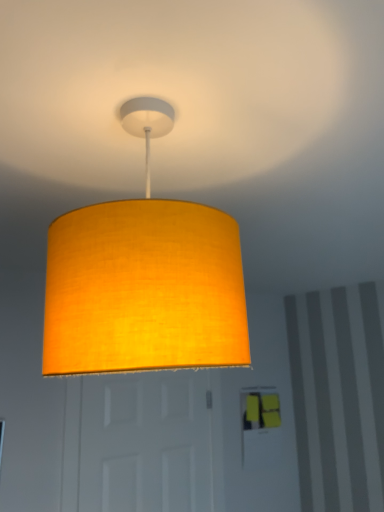
The image size is (384, 512). In order to click on matte yellow fabric lampshade at upper center in this screenshot , I will do `click(144, 279)`.

What do you see at coordinates (144, 279) in the screenshot? I see `matte yellow fabric lampshade at upper center` at bounding box center [144, 279].

This screenshot has height=512, width=384. Find the location of `white matte door at center`. white matte door at center is located at coordinates (146, 443).

What is the approximate height of white matte door at center?

white matte door at center is 70.88 centimeters in height.

Measure the distance between white matte door at center and camera.

white matte door at center and camera are 1.71 meters apart from each other.

From the picture: What is the approximate width of white matte door at center?

white matte door at center is 5.30 inches wide.

This screenshot has height=512, width=384. What do you see at coordinates (146, 443) in the screenshot?
I see `white matte door at center` at bounding box center [146, 443].

Locate an element on the screen. Image resolution: width=384 pixels, height=512 pixels. matte yellow fabric lampshade at upper center is located at coordinates (144, 279).

Between white matte door at center and matte yellow fabric lampshade at upper center, which one appears on the left side from the viewer's perspective?

white matte door at center is more to the left.

Which object is closer to the camera taking this photo, white matte door at center or matte yellow fabric lampshade at upper center?

matte yellow fabric lampshade at upper center is closer to the camera.

Is point (204, 373) positioned in front of point (51, 306)?

No, it is not.

From the image's perspective, relative to matte yellow fabric lampshade at upper center, is white matte door at center above or below?

From the image's perspective, white matte door at center appears below matte yellow fabric lampshade at upper center.

From a real-world perspective, which is physically above, white matte door at center or matte yellow fabric lampshade at upper center?

In real-world perspective, matte yellow fabric lampshade at upper center is above.

Which object is wider, white matte door at center or matte yellow fabric lampshade at upper center?

matte yellow fabric lampshade at upper center is wider.

Can you confirm if white matte door at center is shorter than matte yellow fabric lampshade at upper center?

No, white matte door at center is not shorter than matte yellow fabric lampshade at upper center.

Based on their sizes in the image, would you say white matte door at center is bigger or smaller than matte yellow fabric lampshade at upper center?

white matte door at center is bigger than matte yellow fabric lampshade at upper center.

Is matte yellow fabric lampshade at upper center inside white matte door at center?

That's incorrect, matte yellow fabric lampshade at upper center is not inside white matte door at center.

Is white matte door at center positioned far away from matte yellow fabric lampshade at upper center?

white matte door at center is far away from matte yellow fabric lampshade at upper center.

Is white matte door at center aimed at matte yellow fabric lampshade at upper center?

Yes, white matte door at center is aimed at matte yellow fabric lampshade at upper center.

Identify the location of lamp above the white matte door at center (from the image's perspective). (144, 279).

Considering the relative positions of matte yellow fabric lampshade at upper center and white matte door at center in the image provided, is matte yellow fabric lampshade at upper center to the left of white matte door at center from the viewer's perspective?

No.

Which is in front, matte yellow fabric lampshade at upper center or white matte door at center?

Positioned in front is matte yellow fabric lampshade at upper center.

Which is farther from the camera, (90, 352) or (175, 437)?

The point (175, 437) is more distant.

From the image's perspective, is matte yellow fabric lampshade at upper center over white matte door at center?

Yes.

From a real-world perspective, who is located lower, matte yellow fabric lampshade at upper center or white matte door at center?

white matte door at center.

In terms of width, does matte yellow fabric lampshade at upper center look wider or thinner when compared to white matte door at center?

Considering their sizes, matte yellow fabric lampshade at upper center looks broader than white matte door at center.

Does matte yellow fabric lampshade at upper center have a greater height compared to white matte door at center?

In fact, matte yellow fabric lampshade at upper center may be shorter than white matte door at center.

Can you confirm if matte yellow fabric lampshade at upper center is bigger than white matte door at center?

Incorrect, matte yellow fabric lampshade at upper center is not larger than white matte door at center.

Is white matte door at center inside matte yellow fabric lampshade at upper center?

No, white matte door at center is not inside matte yellow fabric lampshade at upper center.

Is matte yellow fabric lampshade at upper center directly adjacent to white matte door at center?

There is a gap between matte yellow fabric lampshade at upper center and white matte door at center.

Is matte yellow fabric lampshade at upper center positioned with its back to white matte door at center?

matte yellow fabric lampshade at upper center is not turned away from white matte door at center.

Can you tell me how much matte yellow fabric lampshade at upper center and white matte door at center differ in facing direction?

The angle between the facing direction of matte yellow fabric lampshade at upper center and the facing direction of white matte door at center is 84.2 degrees.

Locate an element on the screen. The height and width of the screenshot is (512, 384). door that appears below the matte yellow fabric lampshade at upper center (from the image's perspective) is located at coordinates (146, 443).

Find the location of a particular element. Image resolution: width=384 pixels, height=512 pixels. door to the left of matte yellow fabric lampshade at upper center is located at coordinates (146, 443).

Locate an element on the screen. Image resolution: width=384 pixels, height=512 pixels. door behind the matte yellow fabric lampshade at upper center is located at coordinates (146, 443).